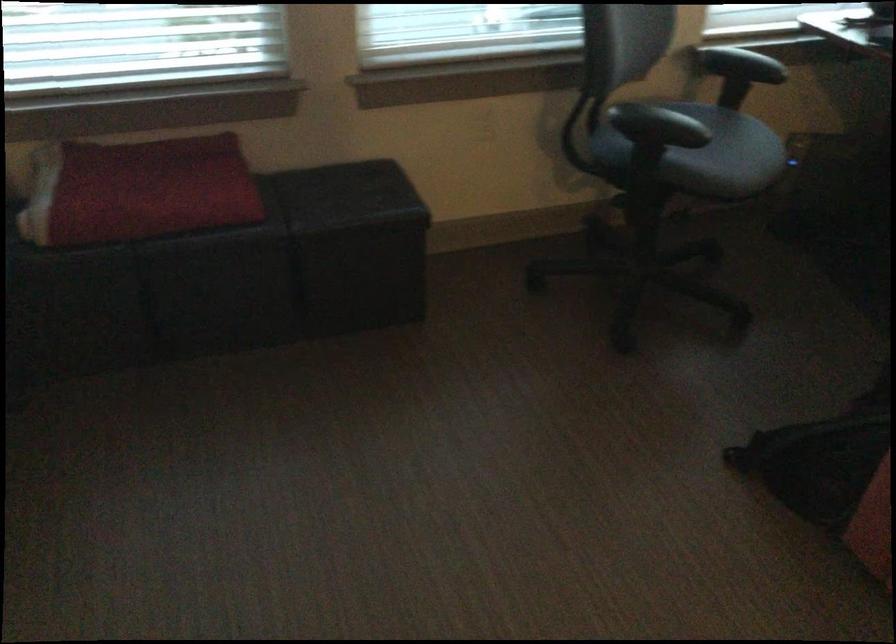
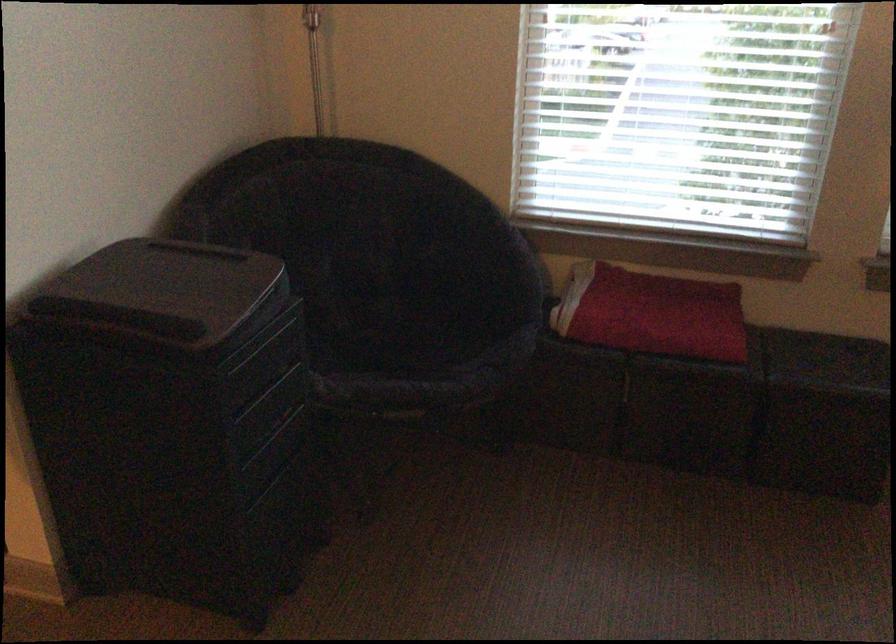
Locate, in the second image, the point that corresponds to (157,200) in the first image.

(651, 313)